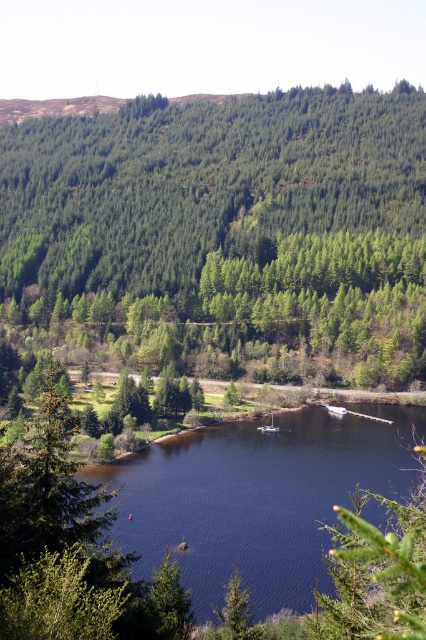
Question: Can you confirm if dark blue water at center is positioned to the right of white plastic boat at center?

Choices:
 (A) no
 (B) yes

Answer: (A)

Question: Does green matte forest at upper center appear under white plastic boat at center?

Choices:
 (A) yes
 (B) no

Answer: (B)

Question: Which object appears farthest from the camera in this image?

Choices:
 (A) white plastic boat at center
 (B) green matte forest at upper center

Answer: (B)

Question: Which object appears closest to the camera in this image?

Choices:
 (A) dark blue water at center
 (B) white plastic boat at center
 (C) green textured tree at lower left

Answer: (C)

Question: Considering the real-world distances, which object is farthest from the green textured tree at lower left?

Choices:
 (A) white plastic boat at center
 (B) dark blue water at center
 (C) green matte forest at upper center

Answer: (C)

Question: From the image, what is the correct spatial relationship of green matte forest at upper center in relation to white plastic boat at center?

Choices:
 (A) left
 (B) right

Answer: (A)